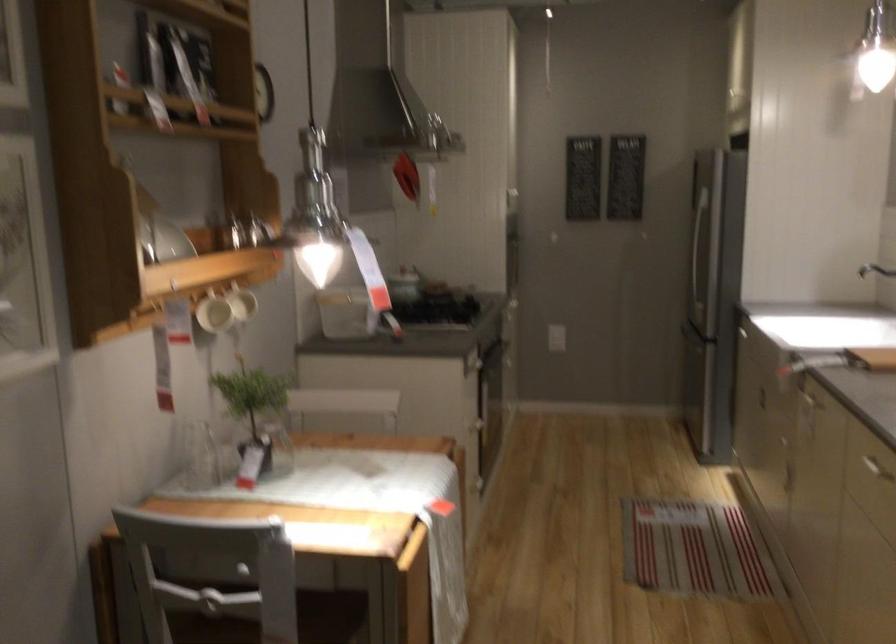
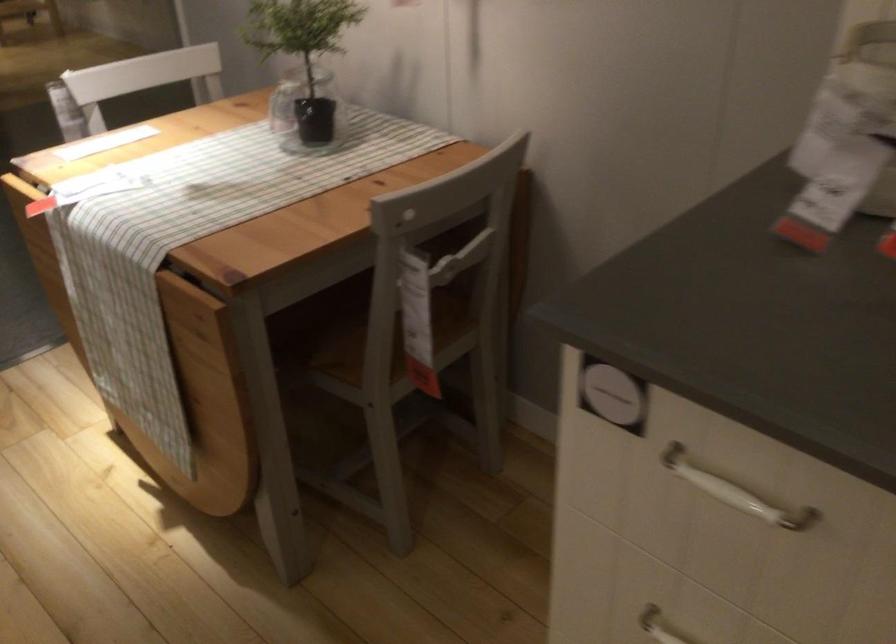
Find the pixel in the second image that matches point (261, 462) in the first image.

(307, 111)